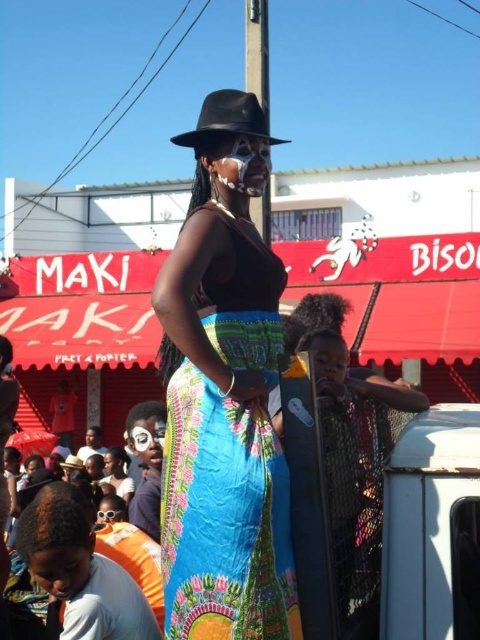
The image size is (480, 640). Find the location of `matte black hat at center`. matte black hat at center is located at coordinates (225, 396).

Is matte black hat at center to the left of black felt fedora at upper center from the viewer's perspective?

Correct, you'll find matte black hat at center to the left of black felt fedora at upper center.

Where is `matte black hat at center`? The image size is (480, 640). matte black hat at center is located at coordinates pos(225,396).